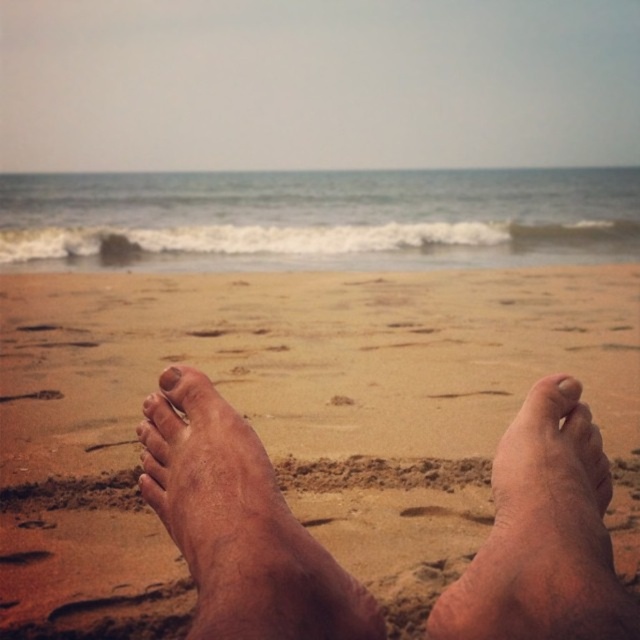
In the scene shown: Is dry skin foot at center above smooth pinkish toe at center?

No, dry skin foot at center is not above smooth pinkish toe at center.

Is dry skin foot at center smaller than smooth pinkish toe at center?

No, dry skin foot at center is not smaller than smooth pinkish toe at center.

Is point (500, 486) closer to viewer compared to point (557, 381)?

Yes, point (500, 486) is closer to viewer.

At what (x,y) coordinates should I click in order to perform the action: click on dry skin foot at center. Please return your answer as a coordinate pair (x, y). Looking at the image, I should click on pyautogui.click(x=541, y=536).

Does brown sandy feet at center lie behind pink matte toe at center?

Yes, it is.

Who is positioned more to the left, brown sandy feet at center or pink matte toe at center?

From the viewer's perspective, pink matte toe at center appears more on the left side.

Describe the element at coordinates (291, 422) in the screenshot. I see `brown sandy feet at center` at that location.

Image resolution: width=640 pixels, height=640 pixels. In order to click on brown sandy feet at center in this screenshot , I will do `click(291, 422)`.

Who is shorter, dry skin foot at center or brown rough toe at center?

brown rough toe at center is shorter.

Can you confirm if dry skin foot at center is positioned above brown rough toe at center?

No, dry skin foot at center is not above brown rough toe at center.

Which is in front, point (547, 528) or point (161, 376)?

Point (547, 528) is more forward.

Where is `dry skin foot at center`? dry skin foot at center is located at coordinates click(541, 536).